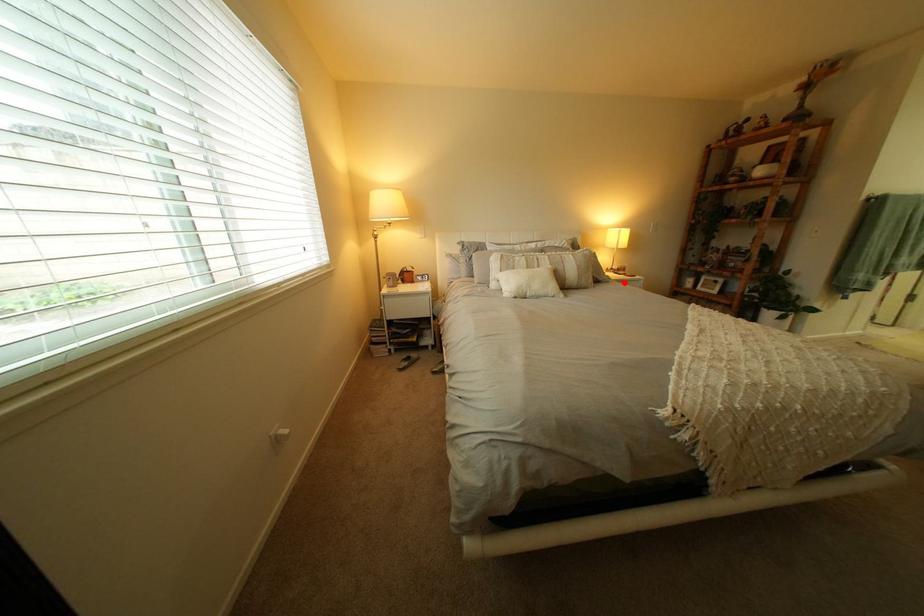
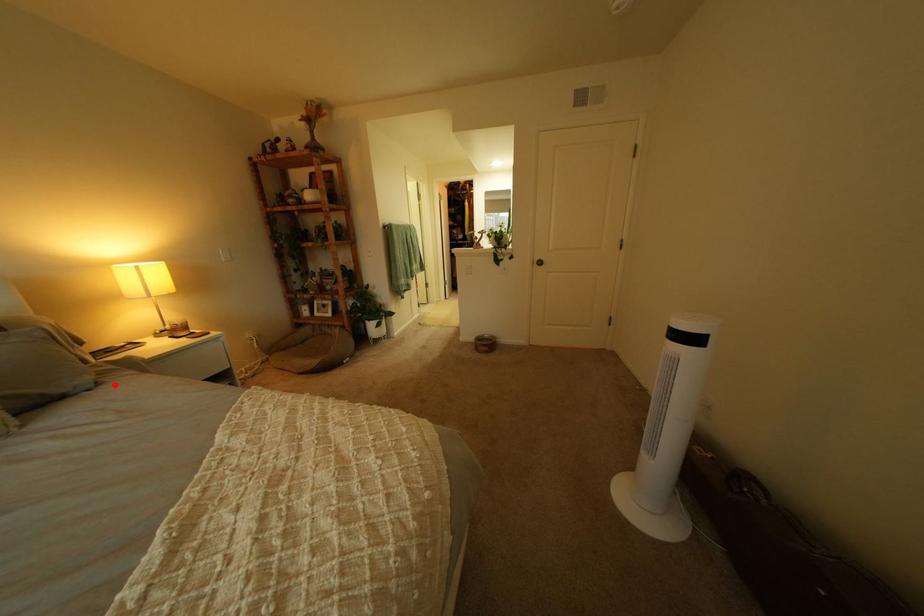
I am providing you with two images of the same scene from different viewpoints. A red point is marked on the first image and another point is marked on the second image. Is the marked point in image1 the same physical position as the marked point in image2?

Yes